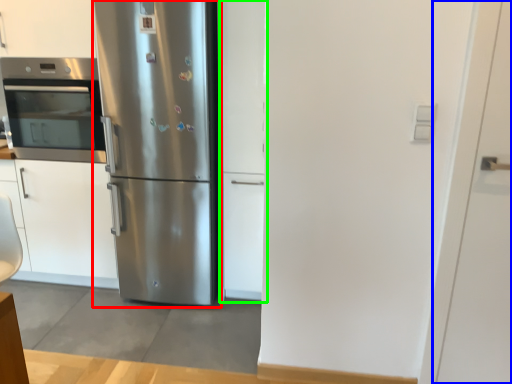
Question: Which object is the closest to the refrigerator (highlighted by a red box)? Choose among these: door (highlighted by a blue box) or door (highlighted by a green box).

Choices:
 (A) door
 (B) door

Answer: (B)